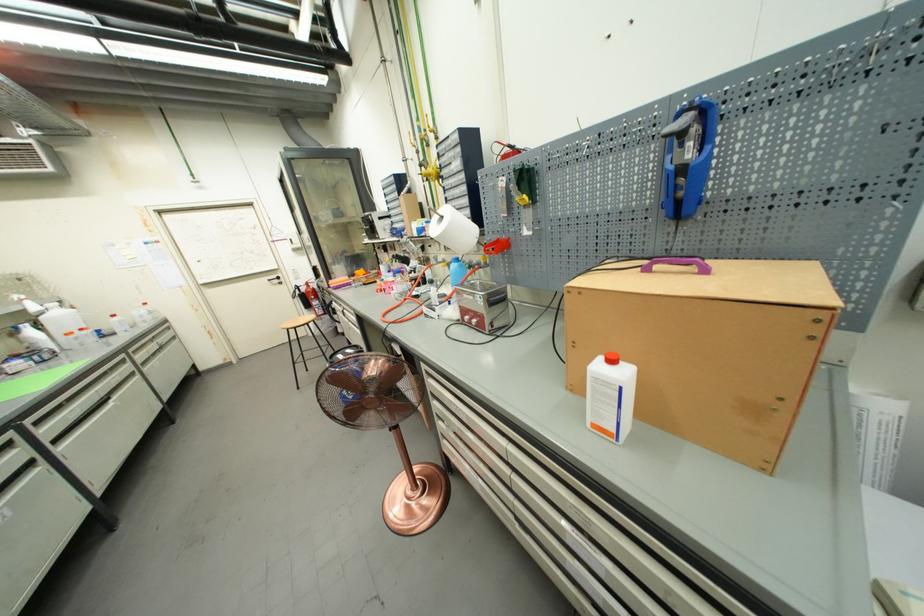
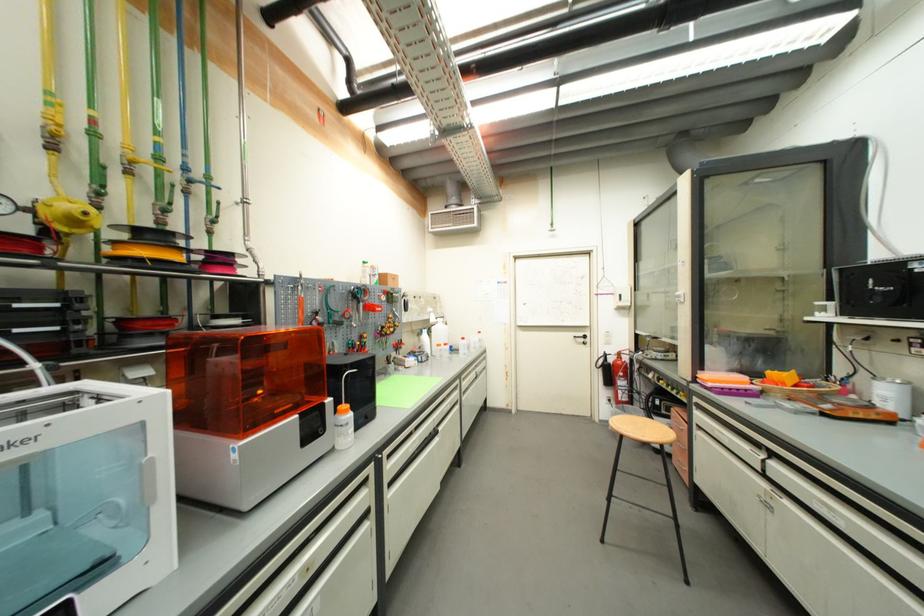
Locate, in the second image, the point that corresponds to point (334, 286) in the first image.

(699, 379)